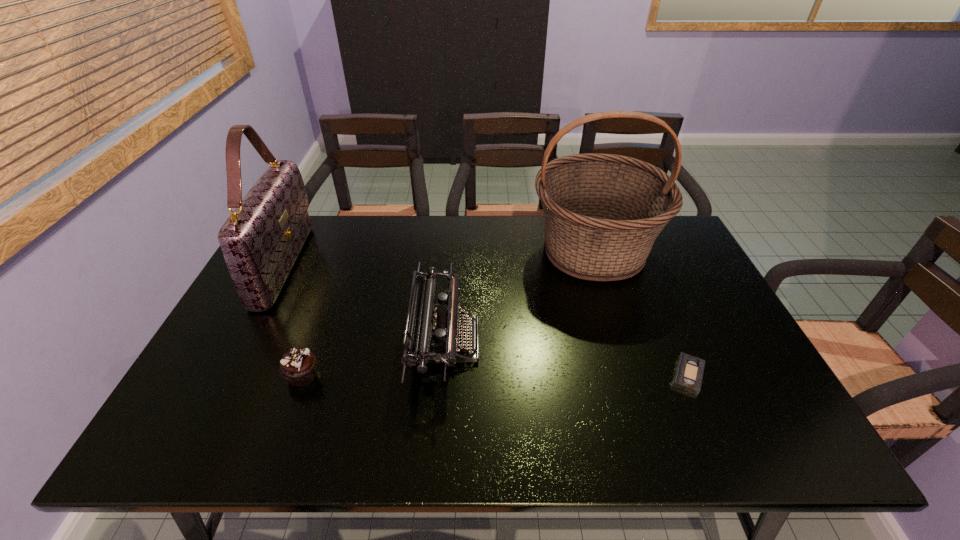
Find the location of a particular element. free space located 0.080m on the left of the second object from left to right is located at coordinates (251, 375).

Locate an element on the screen. This screenshot has width=960, height=540. blank area located 0.400m on the back of the videotape is located at coordinates (636, 255).

In order to click on basket located at the far edge in this screenshot , I will do `click(603, 212)`.

Where is `handbag that is at the far edge`? This screenshot has width=960, height=540. handbag that is at the far edge is located at coordinates (260, 241).

Identify the location of object present at the left edge. (260, 241).

Locate an element on the screen. basket at the right edge is located at coordinates (603, 212).

Locate an element on the screen. The height and width of the screenshot is (540, 960). videotape at the right edge is located at coordinates (689, 372).

The image size is (960, 540). What are the coordinates of `object positioned at the far left corner` in the screenshot? It's located at (260, 241).

Find the location of a particular element. The width and height of the screenshot is (960, 540). object present at the far right corner is located at coordinates (603, 212).

Locate an element on the screen. vacant area at the far edge is located at coordinates (492, 240).